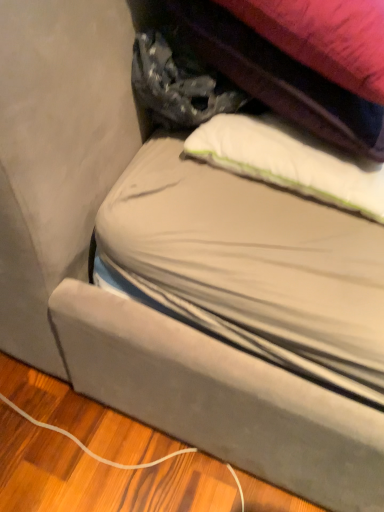
Question: Can you confirm if white soft pillow at upper center is shorter than textured fabric bag at upper center?

Choices:
 (A) yes
 (B) no

Answer: (A)

Question: Can you confirm if white soft pillow at upper center is positioned to the left of textured fabric bag at upper center?

Choices:
 (A) no
 (B) yes

Answer: (A)

Question: Is white soft pillow at upper center closer to the viewer compared to textured fabric bag at upper center?

Choices:
 (A) no
 (B) yes

Answer: (A)

Question: Does white soft pillow at upper center contain textured fabric bag at upper center?

Choices:
 (A) no
 (B) yes

Answer: (A)

Question: From the image's perspective, is white soft pillow at upper center over textured fabric bag at upper center?

Choices:
 (A) no
 (B) yes

Answer: (A)

Question: From a real-world perspective, is white soft pillow at upper center over textured fabric bag at upper center?

Choices:
 (A) yes
 (B) no

Answer: (B)

Question: Would you say textured fabric bag at upper center is outside white soft pillow at upper center?

Choices:
 (A) yes
 (B) no

Answer: (A)

Question: Would you say textured fabric bag at upper center is a long distance from white soft pillow at upper center?

Choices:
 (A) yes
 (B) no

Answer: (B)

Question: Does textured fabric bag at upper center appear on the right side of white soft pillow at upper center?

Choices:
 (A) yes
 (B) no

Answer: (B)

Question: Considering the relative sizes of textured fabric bag at upper center and white soft pillow at upper center in the image provided, is textured fabric bag at upper center taller than white soft pillow at upper center?

Choices:
 (A) yes
 (B) no

Answer: (A)

Question: Can you confirm if textured fabric bag at upper center is wider than white soft pillow at upper center?

Choices:
 (A) yes
 (B) no

Answer: (A)

Question: Considering the relative sizes of textured fabric bag at upper center and white soft pillow at upper center in the image provided, is textured fabric bag at upper center bigger than white soft pillow at upper center?

Choices:
 (A) yes
 (B) no

Answer: (A)

Question: Considering the positions of point (362, 194) and point (244, 90), is point (362, 194) closer or farther from the camera than point (244, 90)?

Choices:
 (A) farther
 (B) closer

Answer: (B)